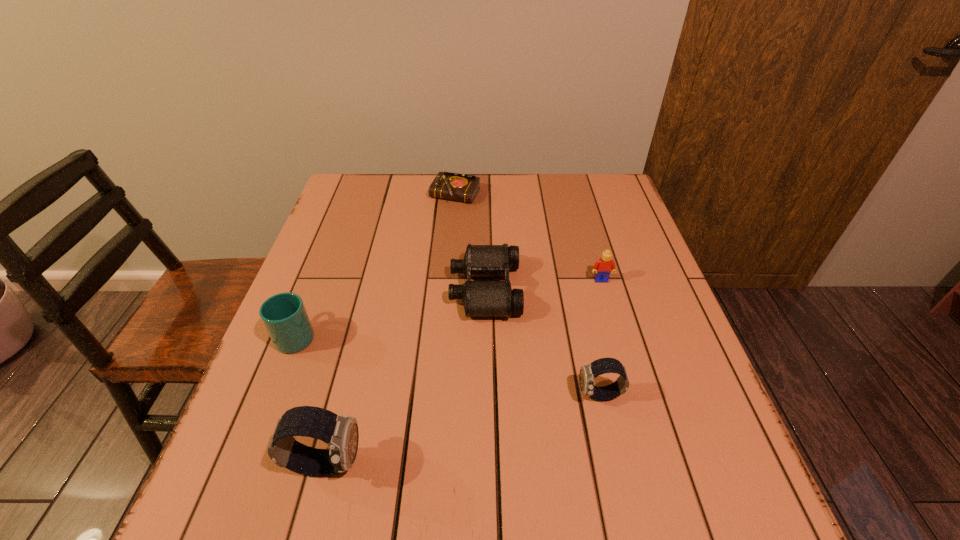
The height and width of the screenshot is (540, 960). What are the coordinates of `the taller watch` in the screenshot? It's located at (x=341, y=434).

This screenshot has height=540, width=960. In order to click on the left watch in this screenshot , I will do `click(341, 434)`.

Find the location of a particular element. The image size is (960, 540). the farther watch is located at coordinates (588, 373).

This screenshot has height=540, width=960. Identify the location of the right watch. (588, 373).

Where is `the farthest object`? This screenshot has width=960, height=540. the farthest object is located at coordinates (452, 186).

Find the location of `the shortest object`. the shortest object is located at coordinates (452, 186).

This screenshot has width=960, height=540. I want to click on the fifth tallest object, so 480,298.

Locate an element on the screen. the leftmost object is located at coordinates (284, 316).

The width and height of the screenshot is (960, 540). What are the coordinates of `Lego` in the screenshot? It's located at (604, 266).

Where is `vacant space located on the face of the nearest object`? vacant space located on the face of the nearest object is located at coordinates (431, 463).